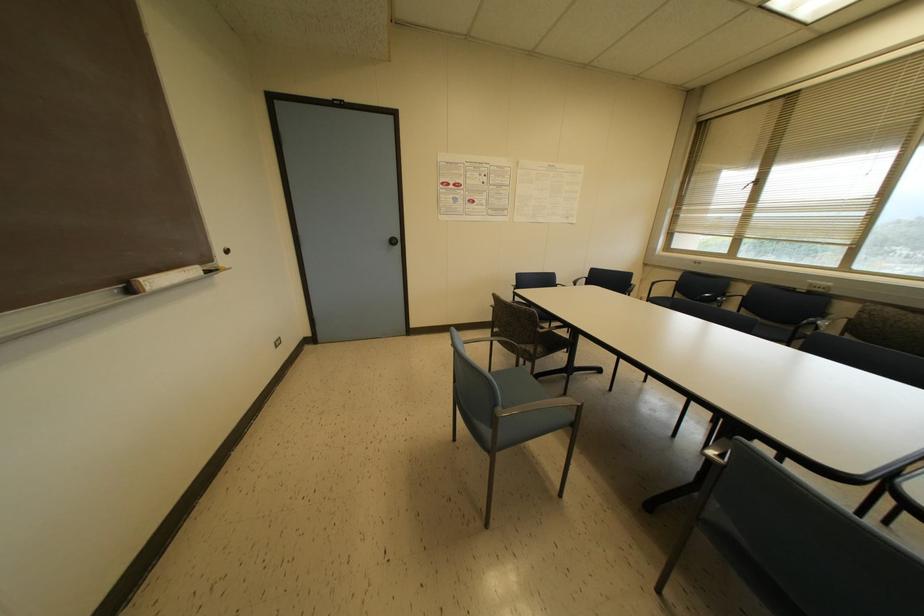
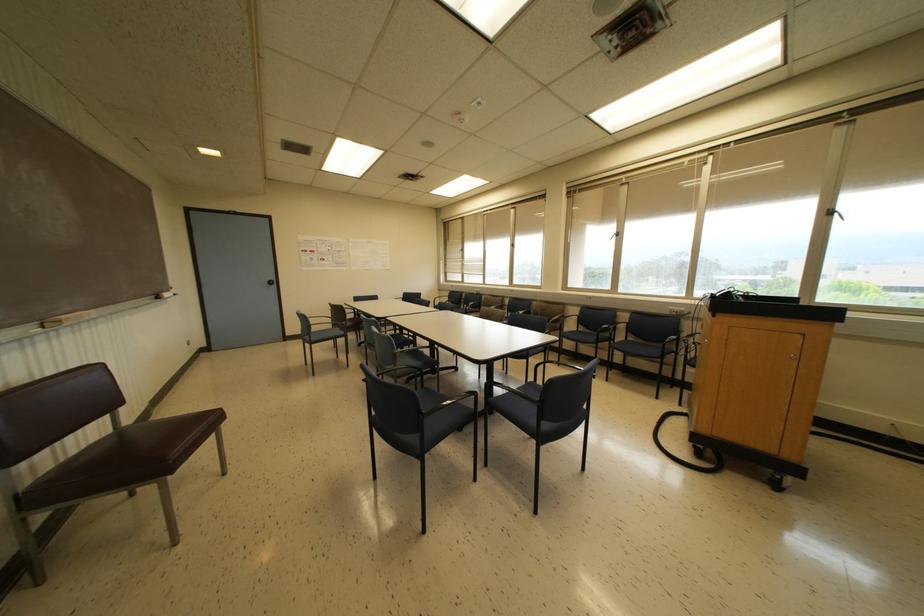
The point at (397, 241) is marked in the first image. Where is the corresponding point in the second image?

(274, 282)